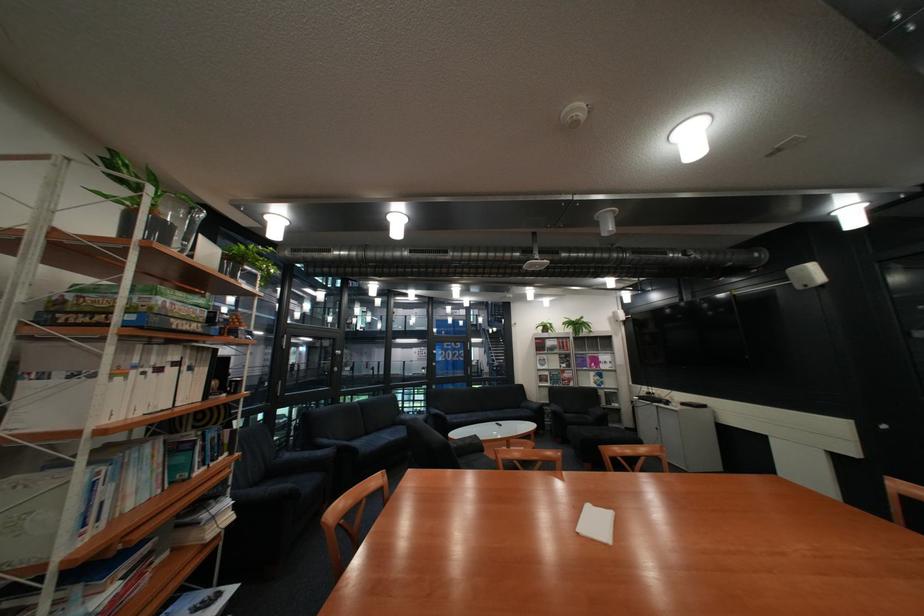
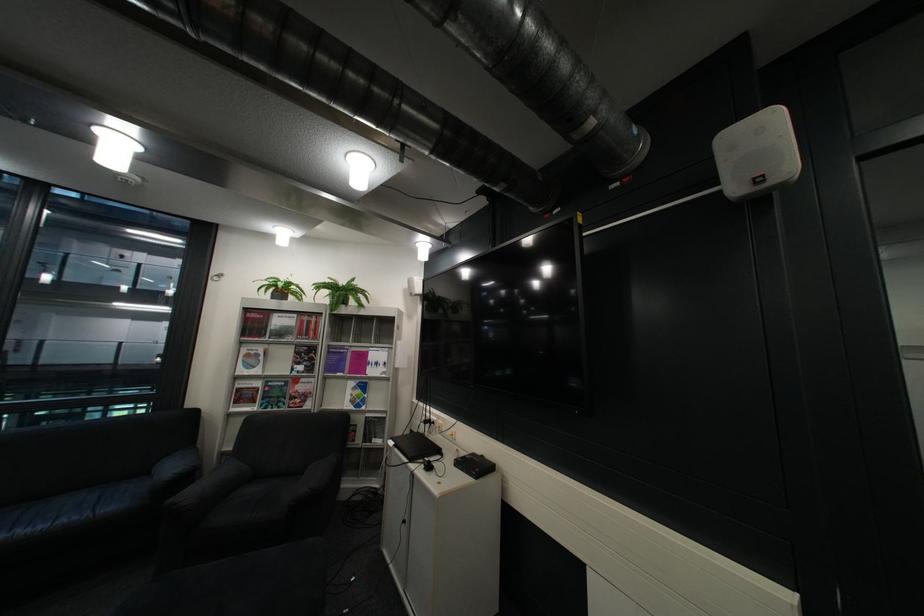
In the second image, find the point that corresponds to [552,342] in the first image.

(260, 320)